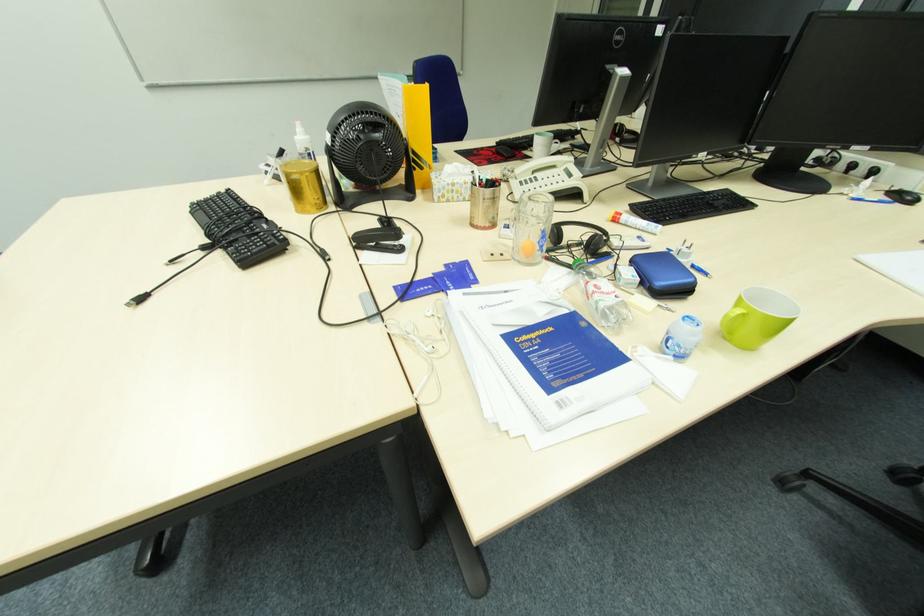
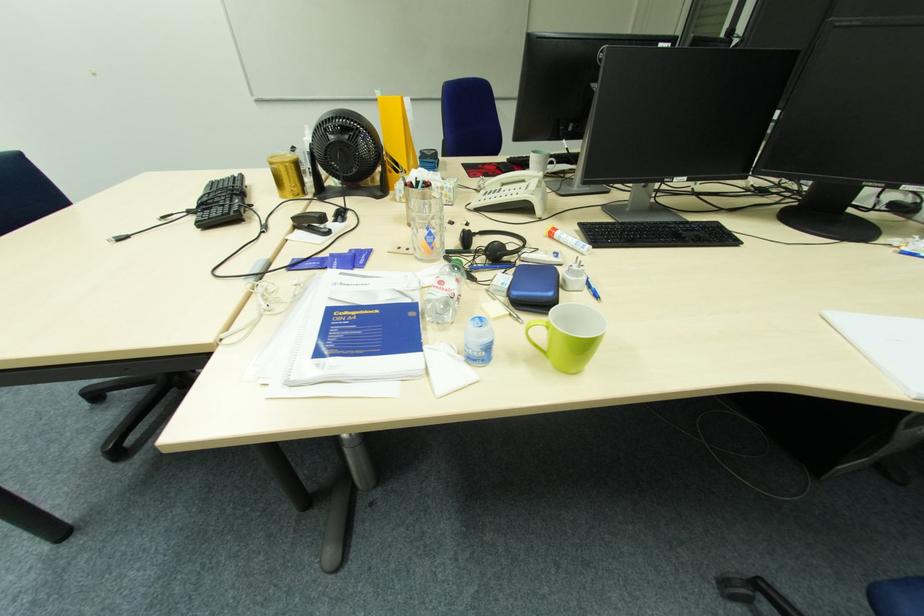
Question: The first image is from the beginning of the video and the second image is from the end. How did the camera likely rotate when shooting the video?

Choices:
 (A) Left
 (B) Right
 (C) Up
 (D) Down

Answer: (A)